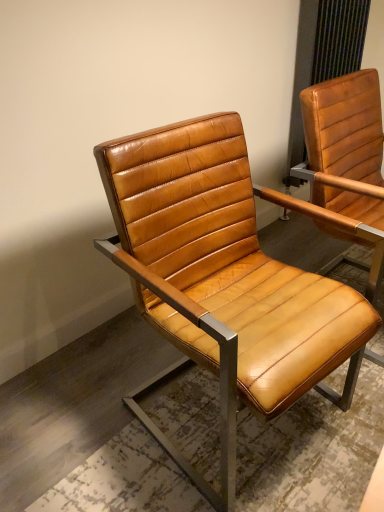
This screenshot has height=512, width=384. What are the coordinates of `free area below cognac leather chair at center, which ranks as the first chair in left-to-right order (from a real-world perspective)` in the screenshot? It's located at (241, 418).